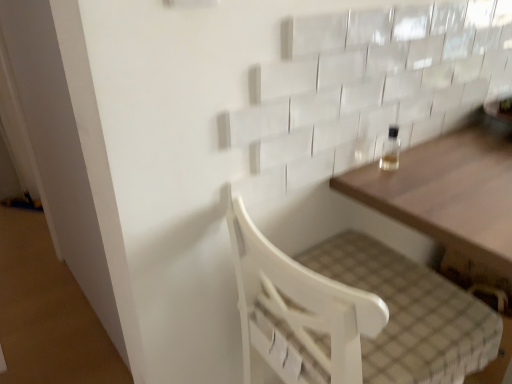
Question: Is wooden table at upper right positioned far away from clear glass bottle at upper right?

Choices:
 (A) yes
 (B) no

Answer: (B)

Question: From a real-world perspective, is wooden table at upper right on top of clear glass bottle at upper right?

Choices:
 (A) yes
 (B) no

Answer: (B)

Question: Is wooden table at upper right looking in the opposite direction of clear glass bottle at upper right?

Choices:
 (A) yes
 (B) no

Answer: (B)

Question: Is wooden table at upper right with clear glass bottle at upper right?

Choices:
 (A) no
 (B) yes

Answer: (A)

Question: Is wooden table at upper right positioned behind clear glass bottle at upper right?

Choices:
 (A) no
 (B) yes

Answer: (A)

Question: Can you confirm if wooden table at upper right is taller than clear glass bottle at upper right?

Choices:
 (A) yes
 (B) no

Answer: (A)

Question: Could you tell me if white wood chair at lower center is facing wooden table at upper right?

Choices:
 (A) yes
 (B) no

Answer: (A)

Question: Is white wood chair at lower center directly adjacent to wooden table at upper right?

Choices:
 (A) no
 (B) yes

Answer: (A)

Question: Is white wood chair at lower center turned away from wooden table at upper right?

Choices:
 (A) yes
 (B) no

Answer: (B)

Question: Considering the relative sizes of white wood chair at lower center and wooden table at upper right in the image provided, is white wood chair at lower center taller than wooden table at upper right?

Choices:
 (A) no
 (B) yes

Answer: (B)

Question: Is white wood chair at lower center at the left side of wooden table at upper right?

Choices:
 (A) yes
 (B) no

Answer: (A)

Question: Can you confirm if white wood chair at lower center is smaller than wooden table at upper right?

Choices:
 (A) no
 (B) yes

Answer: (B)

Question: From the image's perspective, is clear glass bottle at upper right beneath wooden table at upper right?

Choices:
 (A) no
 (B) yes

Answer: (A)